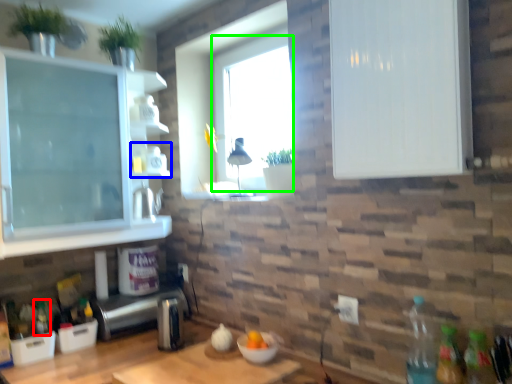
Question: Which is nearer to the bottle (highlighted by a red box)? shelf (highlighted by a blue box) or window screen (highlighted by a green box).

Choices:
 (A) shelf
 (B) window screen

Answer: (A)